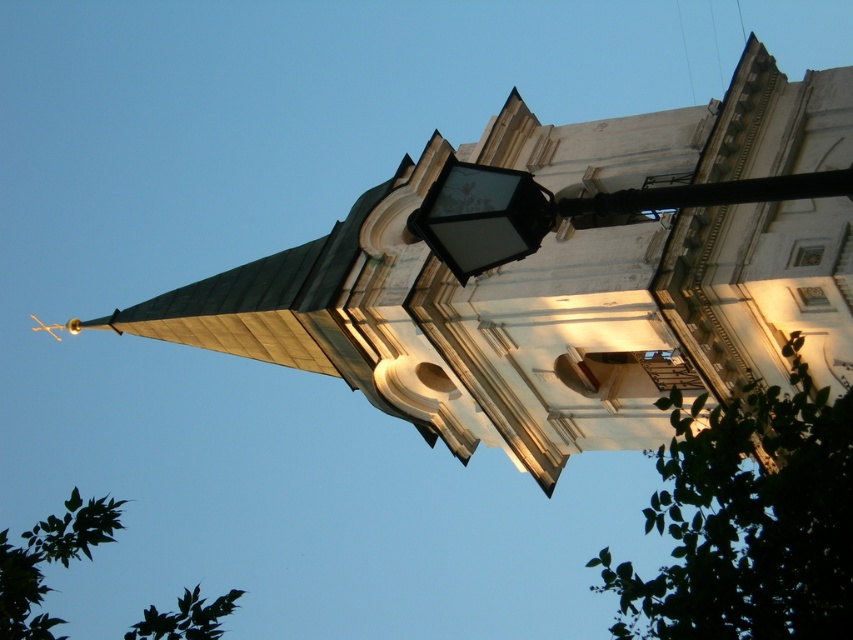
You are standing in front of the church and want to determine the relative positions of two points marked on the building. The first point is located at coordinates point (x=668, y=465) and the second at point (x=457, y=259). Which point is closer to you?

Point (x=668, y=465) is further to the viewer than point (x=457, y=259), so the second point is closer to you.

You are a photographer planning to take a photo of the church. You want to ensure both the green leafy tree at lower right and the black glass lamp post at upper center are clearly visible. Given their sizes, which object might you need to adjust your camera focus on to capture both in detail?

The green leafy tree at lower right is larger than the black glass lamp post at upper center. To capture both in detail, you should focus on the larger object, the green leafy tree at lower right, as it requires more focus due to its size.